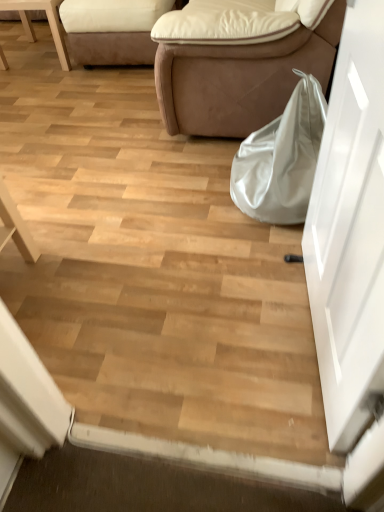
Where is `free space in front of white leather chair at upper left`? Image resolution: width=384 pixels, height=512 pixels. free space in front of white leather chair at upper left is located at coordinates (51, 80).